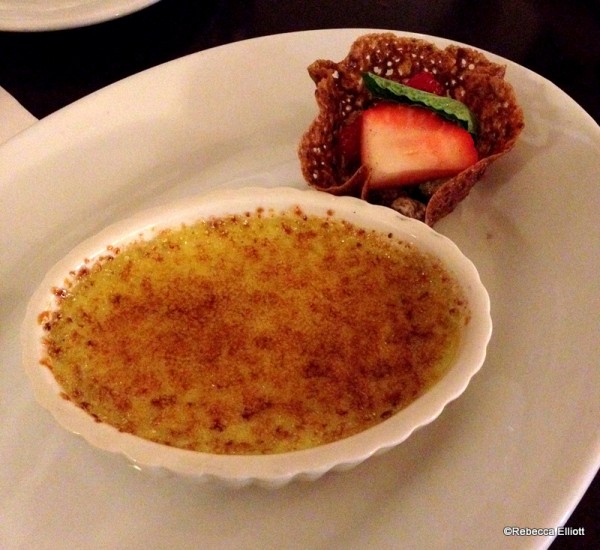
Locate an element on the screen. table is located at coordinates (577, 27).